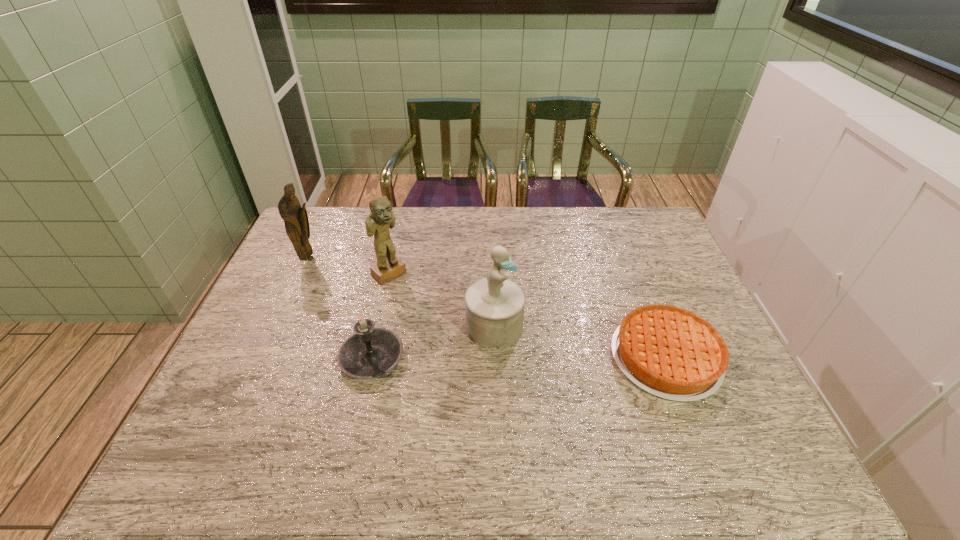
Where is `empty location between the fourth tallest object and the shortest object`? empty location between the fourth tallest object and the shortest object is located at coordinates (518, 357).

This screenshot has height=540, width=960. I want to click on free spot between the pie and the second figurine from left to right, so click(x=527, y=315).

I want to click on vacant area that lies between the second figurine from left to right and the leftmost figurine, so click(349, 266).

You are a GUI agent. You are given a task and a screenshot of the screen. Output one action in this format:
    pyautogui.click(x=<x>, y=<y>)
    Task: Click on the free area in between the candle and the rightmost figurine
    The height and width of the screenshot is (540, 960).
    Given the screenshot: What is the action you would take?
    pyautogui.click(x=433, y=342)

Select which object appears as the second closest to the second figurine from left to right. Please provide its 2D coordinates. Your answer should be formatted as a tuple, i.e. [(x, y)], where the tuple contains the x and y coordinates of a point satisfying the conditions above.

[(370, 352)]

Select which object appears as the third closest to the leftmost object. Please provide its 2D coordinates. Your answer should be formatted as a tuple, i.e. [(x, y)], where the tuple contains the x and y coordinates of a point satisfying the conditions above.

[(494, 305)]

Select which figurine is the second closest to the pie. Please provide its 2D coordinates. Your answer should be formatted as a tuple, i.e. [(x, y)], where the tuple contains the x and y coordinates of a point satisfying the conditions above.

[(381, 218)]

You are a GUI agent. You are given a task and a screenshot of the screen. Output one action in this format:
    pyautogui.click(x=<x>, y=<y>)
    Task: Click on the figurine that stands as the second closest to the leftmost object
    
    Given the screenshot: What is the action you would take?
    pyautogui.click(x=494, y=305)

Identify the location of free point that satisfies the following two spatial constraints: 1. on the back side of the nearest figurine; 2. on the right side of the candle. The height and width of the screenshot is (540, 960). (379, 327).

Find the location of `free region that satisfies the following two spatial constraints: 1. on the front side of the leftmost object; 2. on the right side of the fourth tallest object`. free region that satisfies the following two spatial constraints: 1. on the front side of the leftmost object; 2. on the right side of the fourth tallest object is located at coordinates (265, 357).